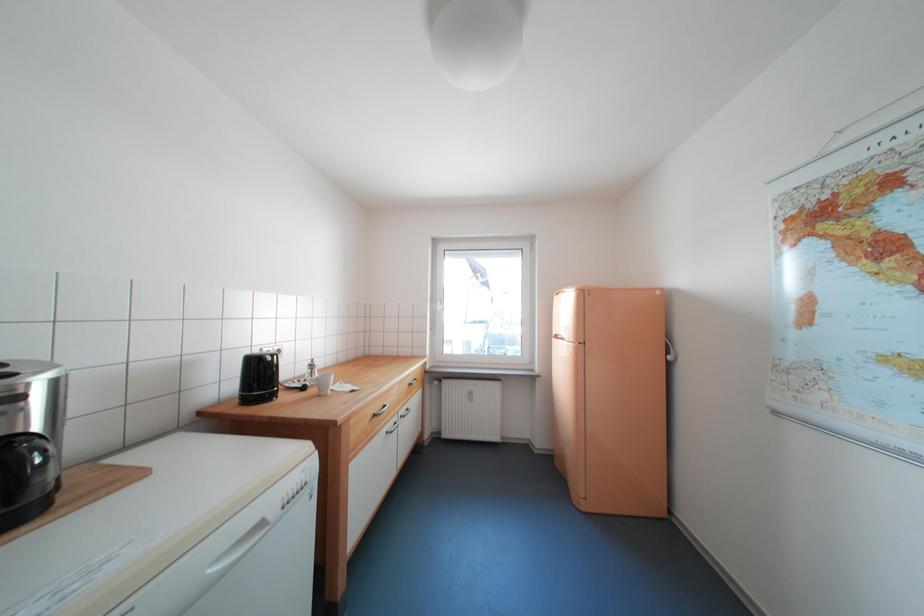
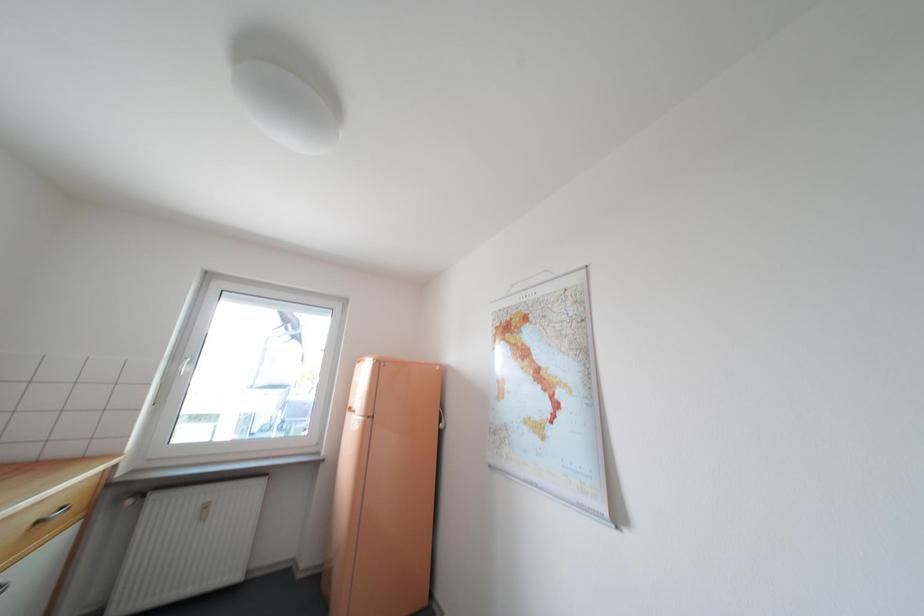
The first image is from the beginning of the video and the second image is from the end. How did the camera likely rotate when shooting the video?

The camera's rotation is toward right-up.